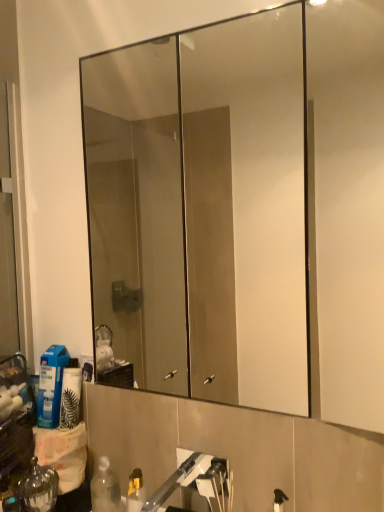
Question: Is blue plastic bottle at lower left positioned in front of brushed metal faucet at lower center?

Choices:
 (A) no
 (B) yes

Answer: (A)

Question: From the image's perspective, is blue plastic bottle at lower left below brushed metal faucet at lower center?

Choices:
 (A) no
 (B) yes

Answer: (A)

Question: Is blue plastic bottle at lower left completely or partially outside of brushed metal faucet at lower center?

Choices:
 (A) yes
 (B) no

Answer: (A)

Question: From a real-world perspective, is blue plastic bottle at lower left located higher than brushed metal faucet at lower center?

Choices:
 (A) no
 (B) yes

Answer: (B)

Question: Considering the relative sizes of blue plastic bottle at lower left and brushed metal faucet at lower center in the image provided, is blue plastic bottle at lower left smaller than brushed metal faucet at lower center?

Choices:
 (A) no
 (B) yes

Answer: (B)

Question: Considering the positions of shiny metallic bottle at lower left and brushed metal faucet at lower center in the image, is shiny metallic bottle at lower left taller or shorter than brushed metal faucet at lower center?

Choices:
 (A) tall
 (B) short

Answer: (A)

Question: Considering the positions of shiny metallic bottle at lower left and brushed metal faucet at lower center in the image, is shiny metallic bottle at lower left bigger or smaller than brushed metal faucet at lower center?

Choices:
 (A) big
 (B) small

Answer: (B)

Question: Would you say shiny metallic bottle at lower left is inside or outside brushed metal faucet at lower center?

Choices:
 (A) inside
 (B) outside

Answer: (B)

Question: From the image's perspective, relative to brushed metal faucet at lower center, is shiny metallic bottle at lower left above or below?

Choices:
 (A) below
 (B) above

Answer: (A)

Question: In the image, is blue plastic bottle at lower left on the left side or the right side of brushed metal faucet at lower center?

Choices:
 (A) left
 (B) right

Answer: (A)

Question: From the image's perspective, is blue plastic bottle at lower left located above or below brushed metal faucet at lower center?

Choices:
 (A) below
 (B) above

Answer: (B)

Question: From a real-world perspective, relative to brushed metal faucet at lower center, is blue plastic bottle at lower left vertically above or below?

Choices:
 (A) below
 (B) above

Answer: (B)

Question: Is blue plastic bottle at lower left situated inside brushed metal faucet at lower center or outside?

Choices:
 (A) outside
 (B) inside

Answer: (A)

Question: Would you say clear glass mirror at upper center is to the left or to the right of blue plastic bottle at lower left in the picture?

Choices:
 (A) right
 (B) left

Answer: (A)

Question: Is clear glass mirror at upper center taller or shorter than blue plastic bottle at lower left?

Choices:
 (A) tall
 (B) short

Answer: (A)